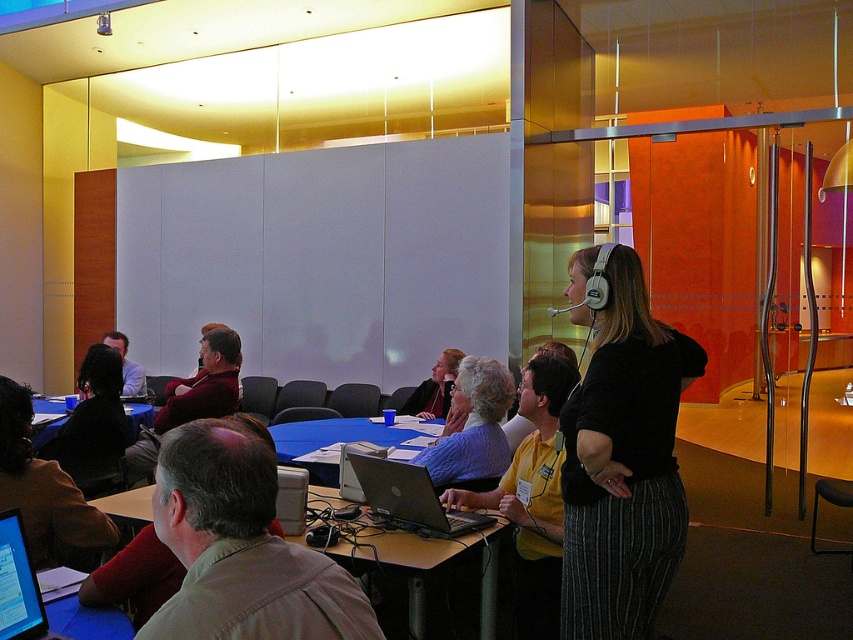
Question: Is the position of light brown shirt at center more distant than that of matte black laptop at center?

Choices:
 (A) yes
 (B) no

Answer: (B)

Question: Among these objects, which one is nearest to the camera?

Choices:
 (A) light brown shirt at center
 (B) blue plastic table at center
 (C) matte black laptop at center

Answer: (A)

Question: Is yellow fabric shirt at center below matte purple shirt at center?

Choices:
 (A) yes
 (B) no

Answer: (A)

Question: Which is farther from the matte black screen at lower left?

Choices:
 (A) dark brown leather jacket at lower left
 (B) dark hair at lower left
 (C) light brown shirt at center
 (D) blue fabric shirt at center

Answer: (B)

Question: Does black fabric shirt at upper right come in front of yellow fabric shirt at center?

Choices:
 (A) no
 (B) yes

Answer: (B)

Question: Among these objects, which one is nearest to the camera?

Choices:
 (A) matte purple shirt at center
 (B) black fabric shirt at upper right
 (C) blue plastic table at center
 (D) dark hair at lower left

Answer: (B)